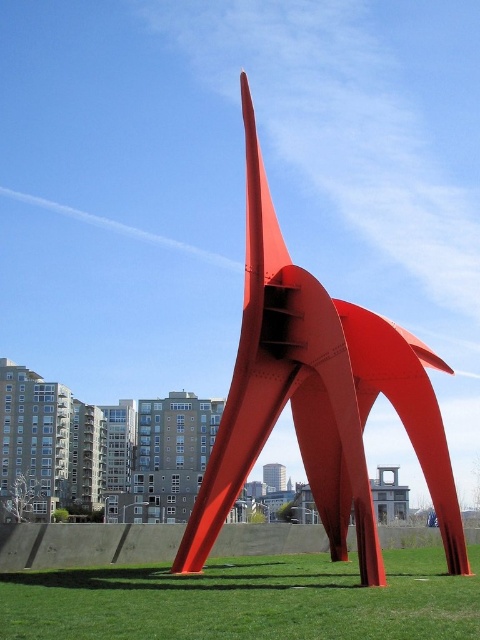
You are standing on the green grass at center and want to walk to the glossy steel sculpture at center. In which direction should you walk?

You should walk to the left because the glossy steel sculpture at center is to the right of green grass at center, so moving left from the grass will lead you towards the sculpture.

You are standing in a park and see the glossy steel sculpture at center and the green grass at center. Which object is closer to you?

The glossy steel sculpture at center is closer to you than the green grass at center.